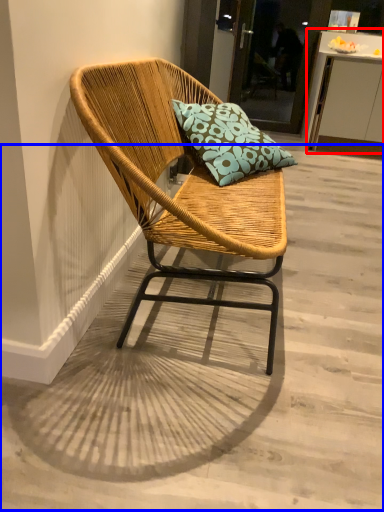
Question: Which object appears farthest to the camera in this image, table (highlighted by a red box) or concrete (highlighted by a blue box)?

Choices:
 (A) table
 (B) concrete

Answer: (A)